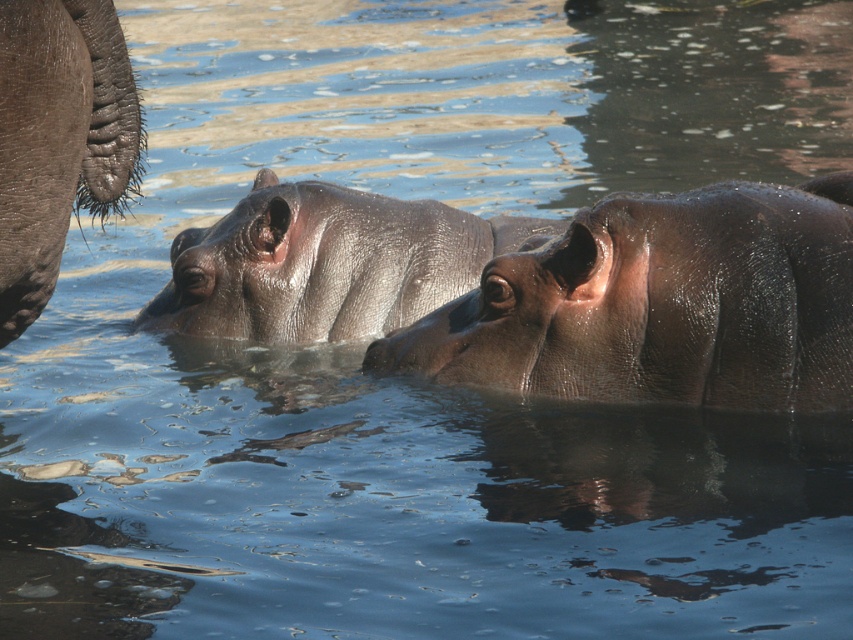
Is point (576, 385) more distant than point (120, 129)?

Yes, it is.

Is point (827, 273) positioned before point (24, 150)?

No.

This screenshot has height=640, width=853. I want to click on shiny brown hippo at center, so click(x=660, y=305).

At what (x,y) coordinates should I click in order to perform the action: click on shiny brown hippo at center. Please return your answer as a coordinate pair (x, y). Looking at the image, I should click on (660, 305).

Does shiny brown hippo at center appear on the right side of slick gray hippo at center?

Indeed, shiny brown hippo at center is positioned on the right side of slick gray hippo at center.

Does point (611, 227) come closer to viewer compared to point (251, 280)?

That is True.

Which is behind, point (827, 340) or point (540, 228)?

Positioned behind is point (540, 228).

Where is `shiny brown hippo at center`? shiny brown hippo at center is located at coordinates (660, 305).

Can you confirm if slick gray hippo at center is smaller than gray textured skin at left?

No, slick gray hippo at center is not smaller than gray textured skin at left.

Is slick gray hippo at center positioned in front of gray textured skin at left?

No, it is behind gray textured skin at left.

Who is more distant from viewer, (434, 209) or (115, 157)?

The point (434, 209) is more distant.

The width and height of the screenshot is (853, 640). What are the coordinates of `slick gray hippo at center` in the screenshot? It's located at (325, 262).